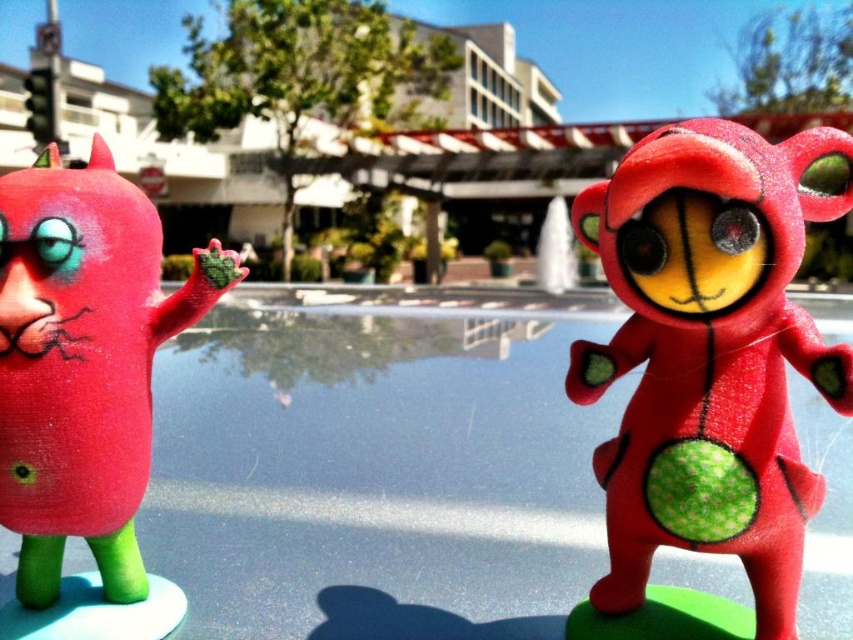
Question: Can you confirm if transparent glass pool at center is positioned above matte red toy at left?

Choices:
 (A) no
 (B) yes

Answer: (A)

Question: Observing the image, what is the correct spatial positioning of transparent glass pool at center in reference to matte red plush toy at right?

Choices:
 (A) above
 (B) below

Answer: (B)

Question: Does transparent glass pool at center appear under matte red toy at left?

Choices:
 (A) yes
 (B) no

Answer: (A)

Question: Which object is farther from the camera taking this photo?

Choices:
 (A) matte red toy at left
 (B) transparent glass pool at center

Answer: (B)

Question: Which of these objects is positioned farthest from the matte red plush toy at right?

Choices:
 (A) matte red toy at left
 (B) transparent glass pool at center

Answer: (A)

Question: Which of the following is the farthest from the observer?

Choices:
 (A) matte red plush toy at right
 (B) transparent glass pool at center
 (C) matte red toy at left

Answer: (B)